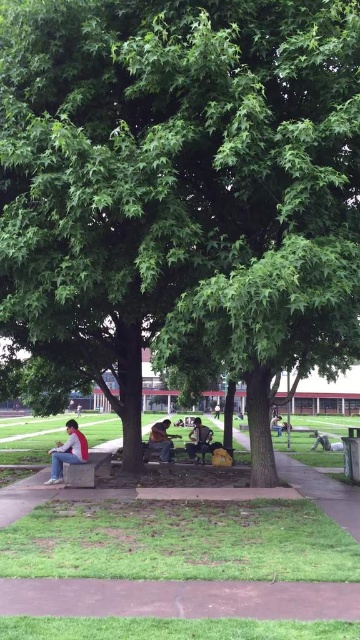
Is brown dirt path at lower center taller than concrete bench at lower left?

No, brown dirt path at lower center is not taller than concrete bench at lower left.

Does point (225, 593) lie behind point (96, 480)?

No.

Is point (117, 604) farther from viewer compared to point (77, 484)?

No, it is not.

Locate an element on the screen. The image size is (360, 640). brown dirt path at lower center is located at coordinates (180, 598).

Who is higher up, concrete bench at lower center or brown dirt path at lower center?

brown dirt path at lower center is higher up.

Which of these two, concrete bench at lower center or brown dirt path at lower center, stands taller?

With more height is concrete bench at lower center.

Which is behind, point (330, 608) or point (140, 604)?

Positioned behind is point (140, 604).

This screenshot has width=360, height=640. Identify the location of concrete bench at lower center. (180, 598).

Can you confirm if denim jeans at lower left is shorter than dark gray fabric jacket at center?

In fact, denim jeans at lower left may be taller than dark gray fabric jacket at center.

The height and width of the screenshot is (640, 360). I want to click on denim jeans at lower left, so click(68, 451).

Who is more distant from viewer, (59, 448) or (210, 440)?

Point (210, 440)

Find the location of a particular element. The height and width of the screenshot is (640, 360). denim jeans at lower left is located at coordinates (68, 451).